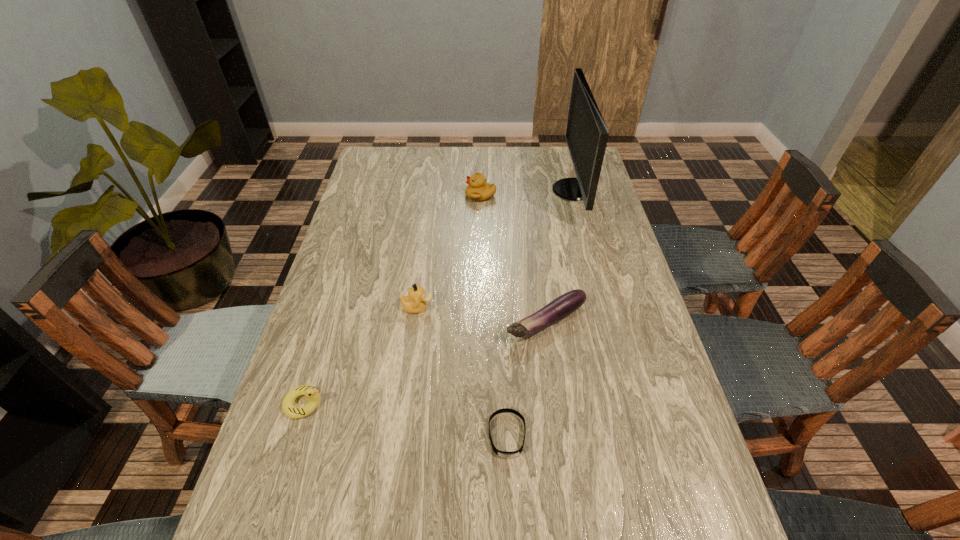
Locate an element on the screen. The image size is (960, 540). vacant space situated 0.120m on the front-facing side of the computer monitor is located at coordinates (519, 190).

Identify the location of vacant space located 0.160m on the front-facing side of the farthest duckling. (420, 195).

The width and height of the screenshot is (960, 540). I want to click on vacant position located on the front-facing side of the farthest duckling, so click(x=435, y=195).

Where is `vacant area situated on the front-facing side of the farthest duckling`? vacant area situated on the front-facing side of the farthest duckling is located at coordinates (357, 195).

Locate an element on the screen. The image size is (960, 540). vacant space located on the face of the second nearest duckling is located at coordinates tap(564, 307).

At what (x,y) coordinates should I click in order to perform the action: click on vacant space located on the back of the eggplant. Please return your answer as a coordinate pair (x, y). Looking at the image, I should click on (541, 282).

Where is `vacant space located 0.190m on the face of the nearest duckling`? The image size is (960, 540). vacant space located 0.190m on the face of the nearest duckling is located at coordinates (406, 403).

Where is `vacant space located on the display of the wristband`? The width and height of the screenshot is (960, 540). vacant space located on the display of the wristband is located at coordinates (510, 500).

The height and width of the screenshot is (540, 960). In order to click on object present at the far edge in this screenshot , I will do `click(586, 135)`.

Find the location of a particular element. The height and width of the screenshot is (540, 960). object that is at the left edge is located at coordinates (312, 394).